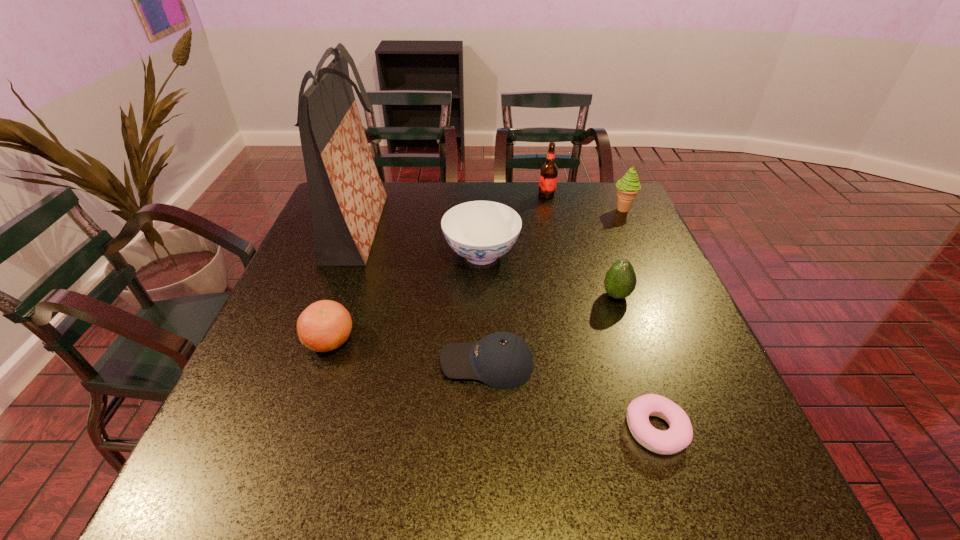
Locate an element on the screen. Image resolution: width=960 pixels, height=540 pixels. free space between the tallest object and the nearest object is located at coordinates (507, 329).

Where is `vacant region between the icecream and the nearest object`? The width and height of the screenshot is (960, 540). vacant region between the icecream and the nearest object is located at coordinates (639, 320).

Where is `blank region between the sixth tallest object and the fourth object from right to left`? blank region between the sixth tallest object and the fourth object from right to left is located at coordinates (438, 267).

This screenshot has width=960, height=540. Identify the location of vacant space in between the root beer and the pastry. (602, 313).

The image size is (960, 540). In order to click on free space between the fourth nearest object and the clementine in this screenshot , I will do `click(473, 318)`.

The width and height of the screenshot is (960, 540). I want to click on free space between the shortest object and the chinaware, so click(569, 342).

This screenshot has width=960, height=540. I want to click on free spot between the sixth shortest object and the fourth nearest object, so pos(619,252).

Choose which object is the second nearest neighbor to the clementine. Please provide its 2D coordinates. Your answer should be formatted as a tuple, i.e. [(x, y)], where the tuple contains the x and y coordinates of a point satisfying the conditions above.

[(347, 197)]

The height and width of the screenshot is (540, 960). I want to click on object that can be found as the fourth closest to the rightmost object, so click(503, 360).

Locate an element on the screen. vacant area that satisfies the following two spatial constraints: 1. on the front side of the third tallest object; 2. on the front-facing side of the tallest object is located at coordinates (631, 228).